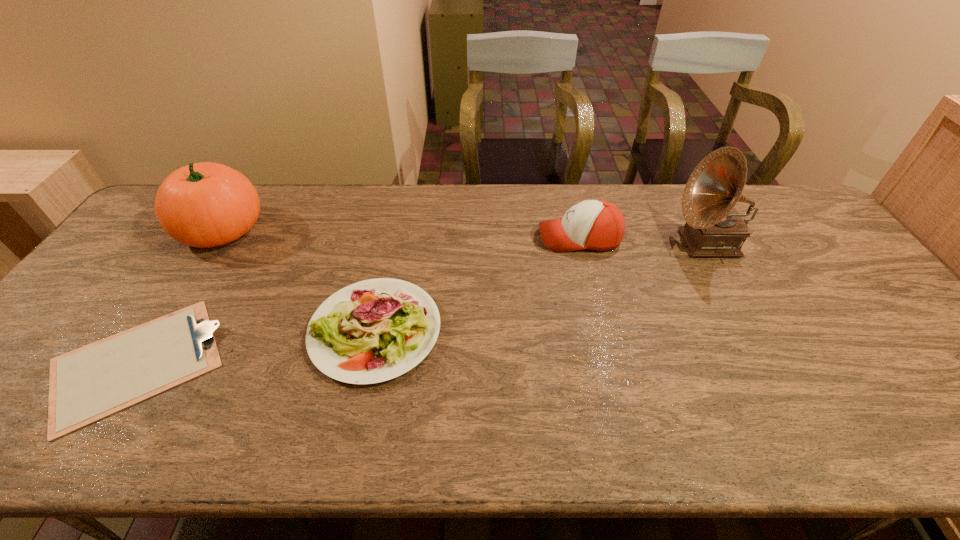
This screenshot has width=960, height=540. What are the coordinates of `free space located on the right of the second tallest object` in the screenshot? It's located at (303, 229).

You are a GUI agent. You are given a task and a screenshot of the screen. Output one action in this format:
    pyautogui.click(x=<x>, y=<y>)
    Task: Click on the free space located 0.130m on the front-facing side of the baseball cap
    
    Given the screenshot: What is the action you would take?
    pyautogui.click(x=495, y=238)

Where is `vacant space located 0.110m on the front-facing side of the baseball cap`? This screenshot has width=960, height=540. vacant space located 0.110m on the front-facing side of the baseball cap is located at coordinates (502, 238).

Identify the location of vacant space located 0.350m on the front-facing side of the baseball cap. (424, 238).

At what (x,y) coordinates should I click in order to perform the action: click on free space located 0.170m on the right of the third object from right to left. Please return your answer as a coordinate pair (x, y). The width and height of the screenshot is (960, 540). Looking at the image, I should click on (508, 330).

Locate an element on the screen. This screenshot has height=540, width=960. phonograph record that is at the far edge is located at coordinates (x=713, y=228).

The image size is (960, 540). What are the coordinates of `pumpkin located at the far edge` in the screenshot? It's located at (205, 204).

Locate an element on the screen. The width and height of the screenshot is (960, 540). baseball cap positioned at the far edge is located at coordinates (598, 225).

Identify the location of object positioned at the left edge. This screenshot has width=960, height=540. (205, 204).

Identify the location of object situated at the far left corner. (205, 204).